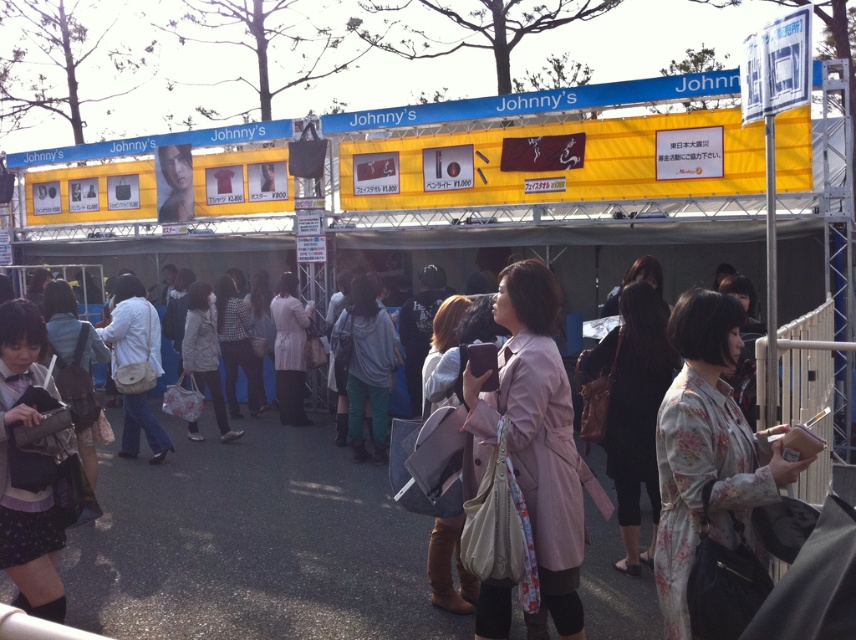
What is located at the point with coordinates (706, 456) in the image?

The point at coordinates (706, 456) corresponds to the floral patterned fabric at center.